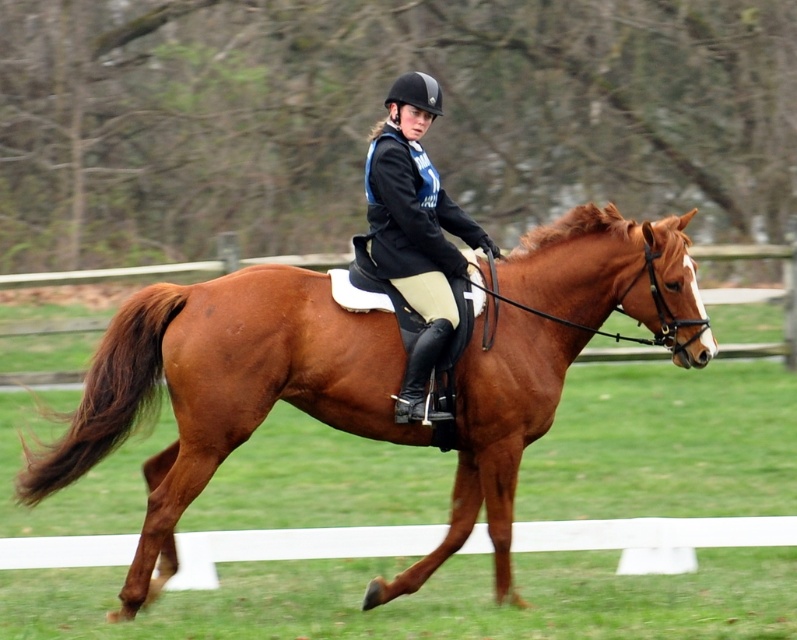
Who is lower down, brown glossy horse at center or matte black helmet at center?

Positioned lower is brown glossy horse at center.

Between brown glossy horse at center and matte black helmet at center, which one is positioned higher?

Positioned higher is matte black helmet at center.

Describe the element at coordinates (220, 388) in the screenshot. I see `brown glossy horse at center` at that location.

You are a GUI agent. You are given a task and a screenshot of the screen. Output one action in this format:
    pyautogui.click(x=<x>, y=<y>)
    Task: Click on the brown glossy horse at center
    This screenshot has height=640, width=797.
    Given the screenshot: What is the action you would take?
    pyautogui.click(x=220, y=388)